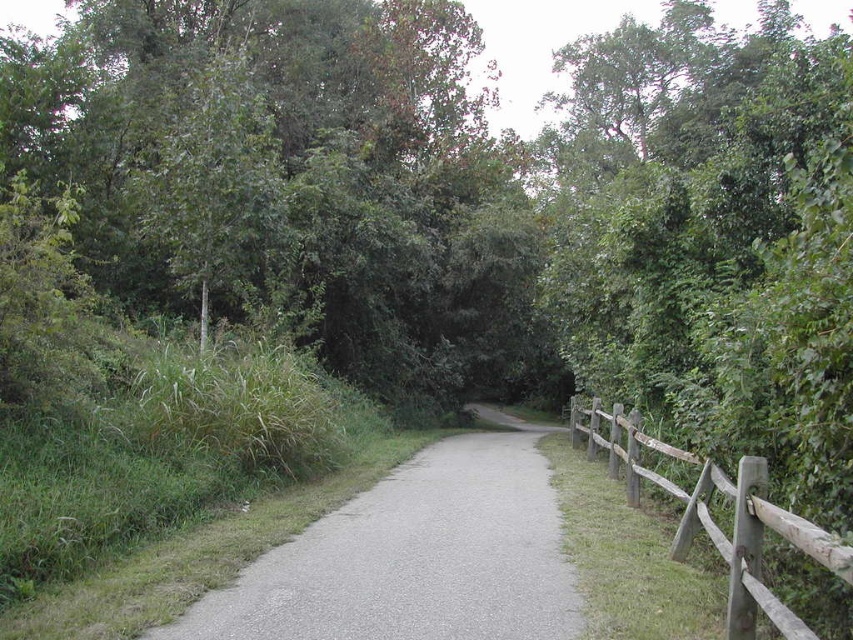
Question: Is green leafy tree at upper left thinner than gray asphalt trail at center?

Choices:
 (A) yes
 (B) no

Answer: (B)

Question: Does green leafy tree at upper left appear on the right side of gray asphalt trail at center?

Choices:
 (A) no
 (B) yes

Answer: (B)

Question: Which object is positioned closest to the brown wooden fence at right?

Choices:
 (A) gray asphalt trail at center
 (B) green leafy tree at upper left

Answer: (A)

Question: Which object is closer to the camera taking this photo?

Choices:
 (A) brown wooden fence at right
 (B) gray asphalt trail at center
 (C) green leafy tree at upper left

Answer: (A)

Question: Can you confirm if gray asphalt trail at center is thinner than brown wooden fence at right?

Choices:
 (A) no
 (B) yes

Answer: (A)

Question: Estimate the real-world distances between objects in this image. Which object is closer to the gray asphalt trail at center?

Choices:
 (A) green leafy tree at upper left
 (B) brown wooden fence at right

Answer: (B)